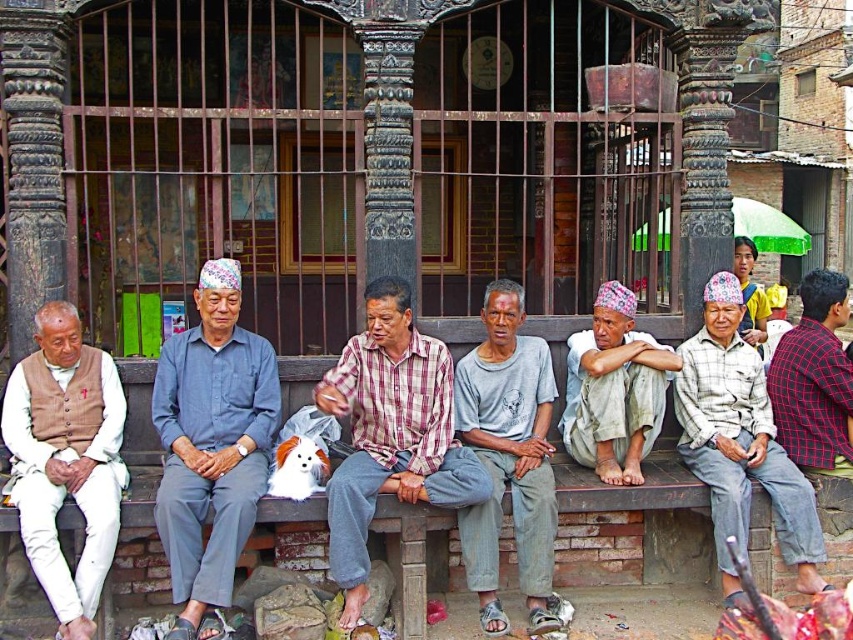
Does light brown fabric vest at left have a greater width compared to brown wooden bench at center?

Indeed, light brown fabric vest at left has a greater width compared to brown wooden bench at center.

Looking at this image, who is positioned more to the left, light brown fabric vest at left or brown wooden bench at center?

light brown fabric vest at left is more to the left.

Where is `light brown fabric vest at left`? The height and width of the screenshot is (640, 853). light brown fabric vest at left is located at coordinates (67, 460).

How much distance is there between blue cotton shirt at left and red plaid shirt at center?

blue cotton shirt at left and red plaid shirt at center are 5.19 meters apart from each other.

Who is shorter, blue cotton shirt at left or red plaid shirt at center?

Standing shorter between the two is red plaid shirt at center.

What are the coordinates of `blue cotton shirt at left` in the screenshot? It's located at (212, 445).

You are a GUI agent. You are given a task and a screenshot of the screen. Output one action in this format:
    pyautogui.click(x=<x>, y=<y>)
    Task: Click on the blue cotton shirt at left
    Image resolution: width=853 pixels, height=640 pixels.
    Given the screenshot: What is the action you would take?
    pyautogui.click(x=212, y=445)

Does gray cotton shirt at center have a lesser width compared to white cotton shirt at center?

No.

Can you confirm if gray cotton shirt at center is taller than white cotton shirt at center?

Indeed, gray cotton shirt at center has a greater height compared to white cotton shirt at center.

Find the location of `gray cotton shirt at center`. gray cotton shirt at center is located at coordinates (508, 458).

Find the location of a particular element. This screenshot has height=640, width=853. gray cotton shirt at center is located at coordinates (508, 458).